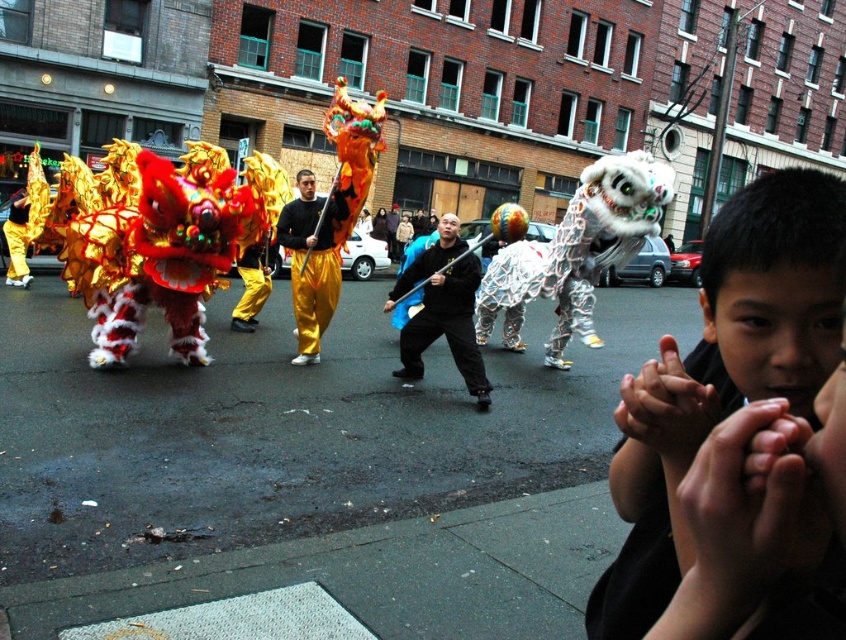
Question: Is black matte/softobject at center below golden silk pants at center?

Choices:
 (A) yes
 (B) no

Answer: (A)

Question: Which of the following is the farthest from the observer?

Choices:
 (A) smooth black shirt at center
 (B) black matte/softobject at center

Answer: (B)

Question: Can you confirm if black matte/softobject at center is wider than golden silk pants at center?

Choices:
 (A) yes
 (B) no

Answer: (A)

Question: Can you confirm if smooth black shirt at center is positioned to the left of golden silk pants at center?

Choices:
 (A) no
 (B) yes

Answer: (A)

Question: Which object is positioned farthest from the smooth black shirt at center?

Choices:
 (A) black matte/softobject at center
 (B) golden silk pants at center

Answer: (B)

Question: Among these objects, which one is nearest to the camera?

Choices:
 (A) black matte/softobject at center
 (B) smooth black shirt at center
 (C) golden silk pants at center

Answer: (B)